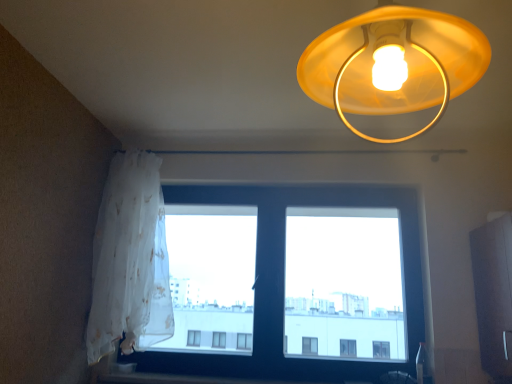
Question: In the image, is smooth wood window sill at lower center positioned in front of or behind white sheer curtain at left?

Choices:
 (A) behind
 (B) front

Answer: (A)

Question: Would you say smooth wood window sill at lower center is inside or outside white sheer curtain at left?

Choices:
 (A) outside
 (B) inside

Answer: (A)

Question: Based on their relative distances, which object is nearer to the smooth wood window sill at lower center?

Choices:
 (A) white sheer curtain at left
 (B) translucent yellow plastic lampshade at upper center
 (C) transparent fabric at lower left

Answer: (C)

Question: Based on their relative distances, which object is nearer to the transparent fabric at lower left?

Choices:
 (A) smooth wood window sill at lower center
 (B) white sheer curtain at left
 (C) translucent yellow plastic lampshade at upper center

Answer: (B)